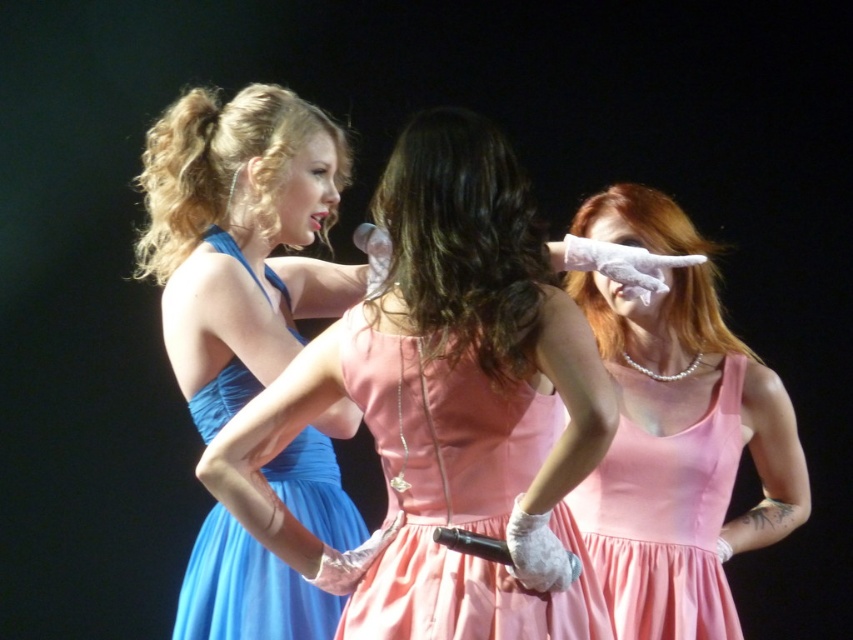
Who is more distant from viewer, (x=663, y=349) or (x=628, y=589)?

The point (x=663, y=349) is more distant.

Which is behind, point (657, 634) or point (643, 429)?

Positioned behind is point (643, 429).

The height and width of the screenshot is (640, 853). What are the coordinates of `pearl necklace at upper right` in the screenshot? It's located at (682, 458).

Consider the image. Does matte blue dress at left appear over blue satin dress at left?

Yes, matte blue dress at left is above blue satin dress at left.

Is matte blue dress at left to the left of blue satin dress at left from the viewer's perspective?

In fact, matte blue dress at left is to the right of blue satin dress at left.

The width and height of the screenshot is (853, 640). What do you see at coordinates (447, 401) in the screenshot? I see `matte blue dress at left` at bounding box center [447, 401].

I want to click on matte blue dress at left, so click(x=447, y=401).

Is matte blue dress at left taller than pearl necklace at upper right?

Incorrect, matte blue dress at left's height is not larger of pearl necklace at upper right's.

Can you confirm if matte blue dress at left is smaller than pearl necklace at upper right?

Indeed, matte blue dress at left has a smaller size compared to pearl necklace at upper right.

The width and height of the screenshot is (853, 640). Describe the element at coordinates (447, 401) in the screenshot. I see `matte blue dress at left` at that location.

You are a GUI agent. You are given a task and a screenshot of the screen. Output one action in this format:
    pyautogui.click(x=<x>, y=<y>)
    Task: Click on the matte blue dress at left
    This screenshot has width=853, height=640.
    Given the screenshot: What is the action you would take?
    pyautogui.click(x=447, y=401)